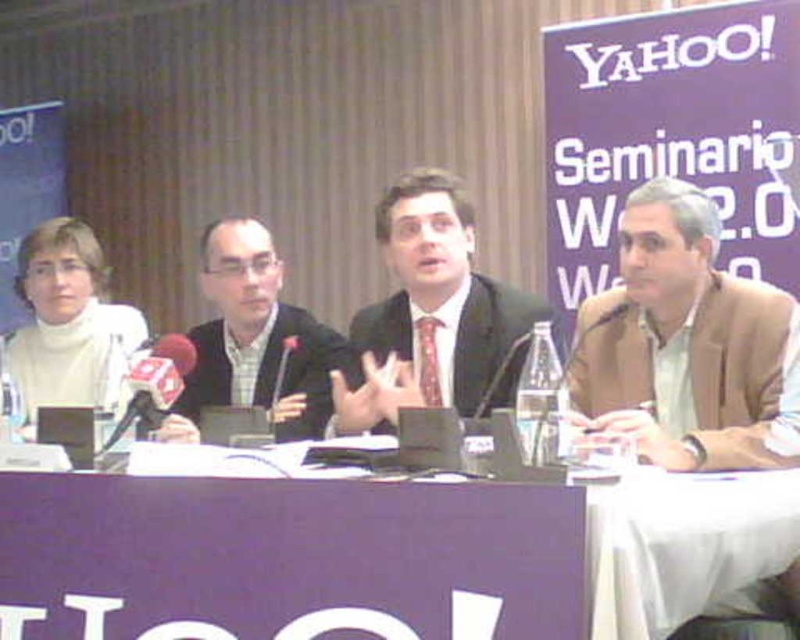
Question: Does brown leather jacket at right appear on the left side of metallic red microphone at left?

Choices:
 (A) no
 (B) yes

Answer: (A)

Question: From the image, what is the correct spatial relationship of purple fabric table at center in relation to metallic red microphone at left?

Choices:
 (A) above
 (B) below

Answer: (B)

Question: Which point is closer to the camera?

Choices:
 (A) tap(182, 346)
 (B) tap(344, 369)
 (C) tap(20, 266)

Answer: (A)

Question: Among these points, which one is farthest from the camera?

Choices:
 (A) (18, 385)
 (B) (456, 186)
 (C) (605, 625)
 (D) (598, 332)

Answer: (A)

Question: Which point is farther to the camera?

Choices:
 (A) (96, 259)
 (B) (630, 413)
 (C) (117, 436)

Answer: (A)

Question: Does brown leather jacket at right have a lesser width compared to matte black suit at center?

Choices:
 (A) yes
 (B) no

Answer: (A)